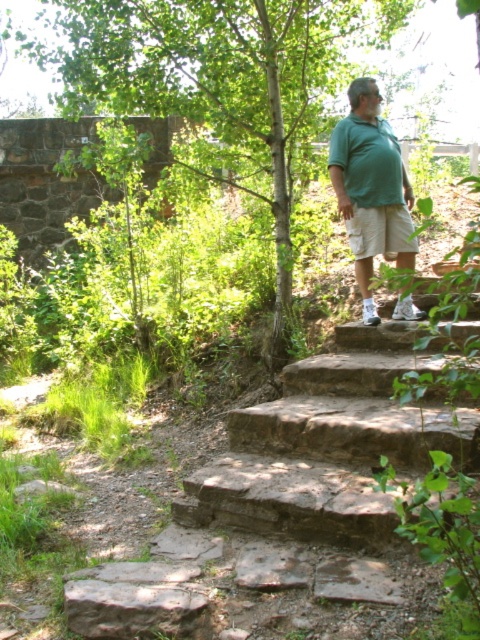
Find the location of `green leafy tree at upper center`. green leafy tree at upper center is located at coordinates (215, 74).

Does green leafy tree at upper center have a lesser height compared to brown rough stone at lower left?

In fact, green leafy tree at upper center may be taller than brown rough stone at lower left.

Which is behind, point (184, 58) or point (120, 602)?

Point (184, 58)

Where is `green leafy tree at upper center`? green leafy tree at upper center is located at coordinates (215, 74).

The width and height of the screenshot is (480, 640). Find the location of `green leafy tree at upper center`. green leafy tree at upper center is located at coordinates 215,74.

The width and height of the screenshot is (480, 640). What do you see at coordinates (215, 74) in the screenshot?
I see `green leafy tree at upper center` at bounding box center [215, 74].

Where is `green leafy tree at upper center`? This screenshot has width=480, height=640. green leafy tree at upper center is located at coordinates (215, 74).

How distant is green leafy tree at upper center from green cotton shirt at upper right?

A distance of 32.58 inches exists between green leafy tree at upper center and green cotton shirt at upper right.

Which is below, green leafy tree at upper center or green cotton shirt at upper right?

green cotton shirt at upper right

The image size is (480, 640). What do you see at coordinates (215, 74) in the screenshot? I see `green leafy tree at upper center` at bounding box center [215, 74].

Where is `green leafy tree at upper center`? green leafy tree at upper center is located at coordinates pos(215,74).